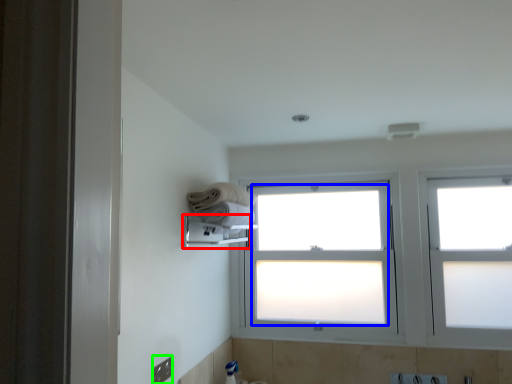
Question: Which is farther away from towel bar (highlighted by a red box)? bay window (highlighted by a blue box) or electric outlet (highlighted by a green box)?

Choices:
 (A) bay window
 (B) electric outlet

Answer: (B)